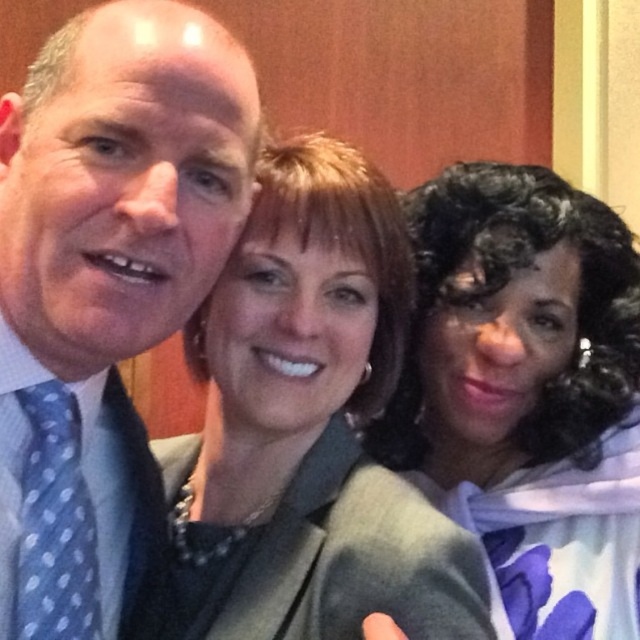
You are a photographer who needs to adjust the lighting to ensure both the matte gray blazer at center and the curly hair at center are well lit. Given their sizes, which object should you focus the light on first?

The matte gray blazer at center is bigger than curly hair at center, so you should focus the light on the matte gray blazer at center first to ensure proper illumination of the larger area.

You are a photographer trying to adjust the lighting for the trio. You need to ensure that the matte gray blazer at center and the blue polka dot tie at left are both well lit. Based on their positions, which object is closer to the right side of the frame?

The matte gray blazer at center is positioned on the right side of the blue polka dot tie at left, so the matte gray blazer at center is closer to the right side of the frame.

Looking at this image, you are a photographer trying to fit all three people into a frame. The blue dotted tie at left and the green wool blazer at center are visible. Which object is narrower to help with framing?

The blue dotted tie at left is narrower than the green wool blazer at center, so it can help with framing as it takes up less space.